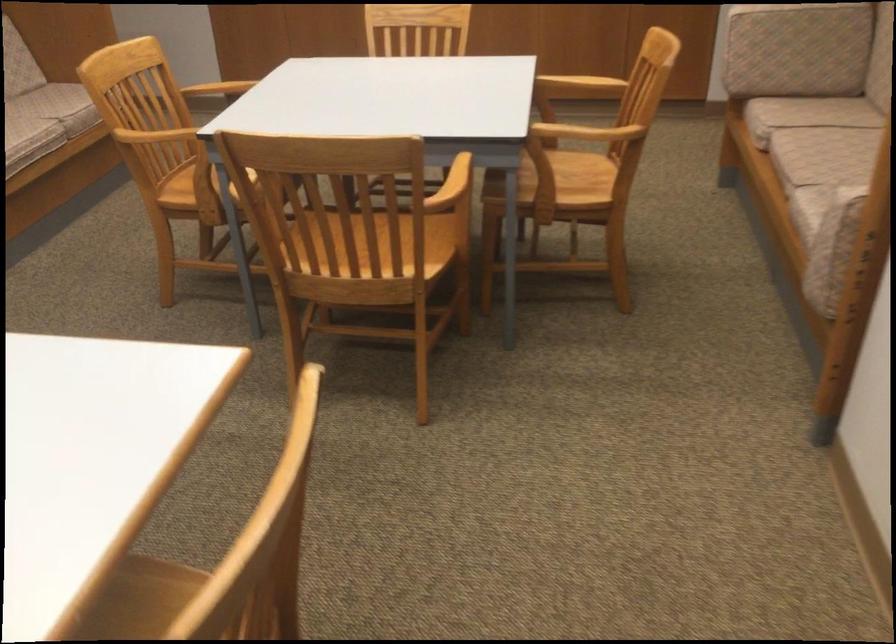
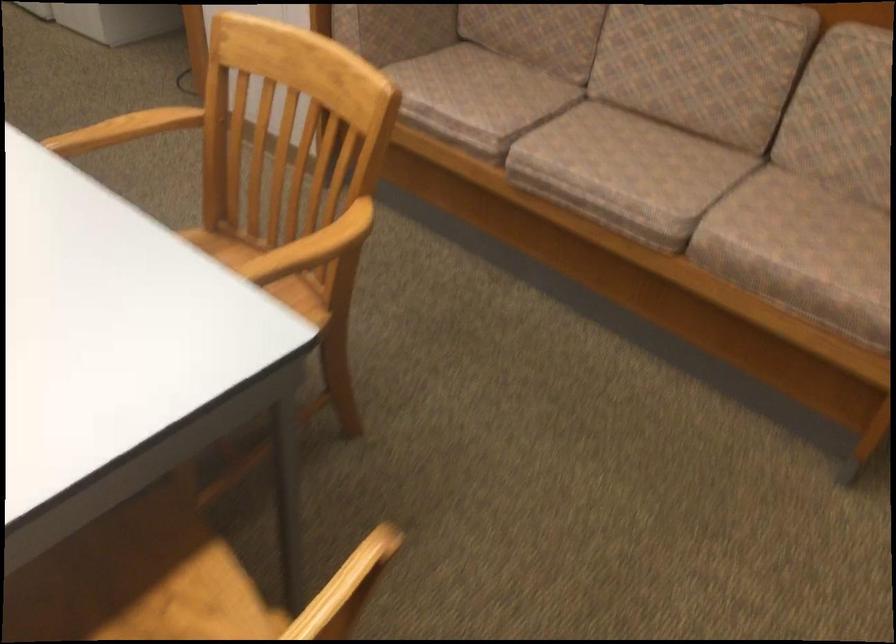
The point at (174, 192) is marked in the first image. Where is the corresponding point in the second image?

(218, 247)